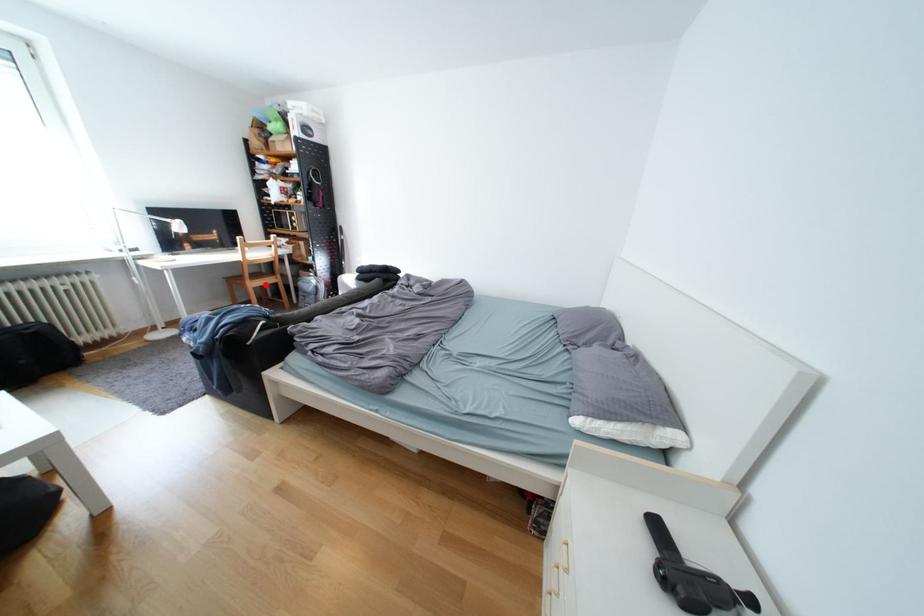
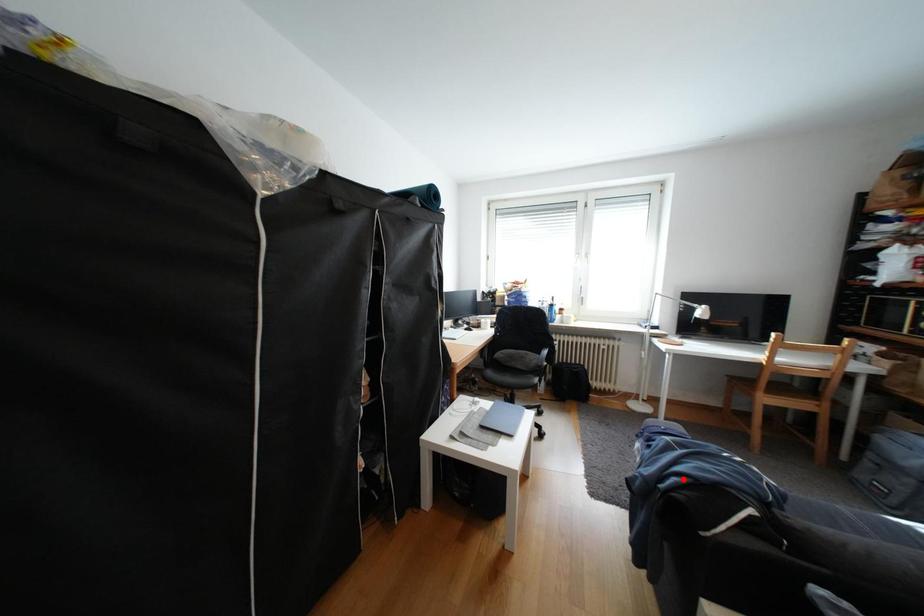
I am providing you with two images of the same scene from different viewpoints. A red point is marked on the first image and another point is marked on the second image. Are the points marked in image1 and image2 representing the same 3D position?

No